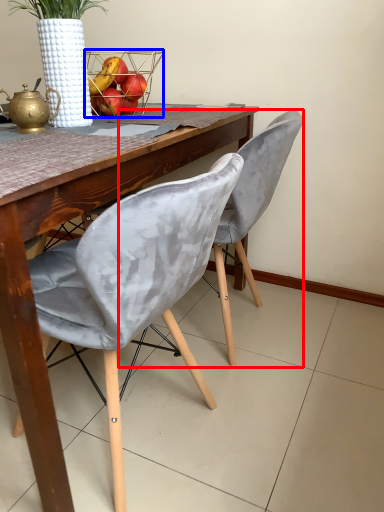
Question: Among these objects, which one is nearest to the camera, chair (highlighted by a red box) or basket (highlighted by a blue box)?

Choices:
 (A) chair
 (B) basket

Answer: (A)